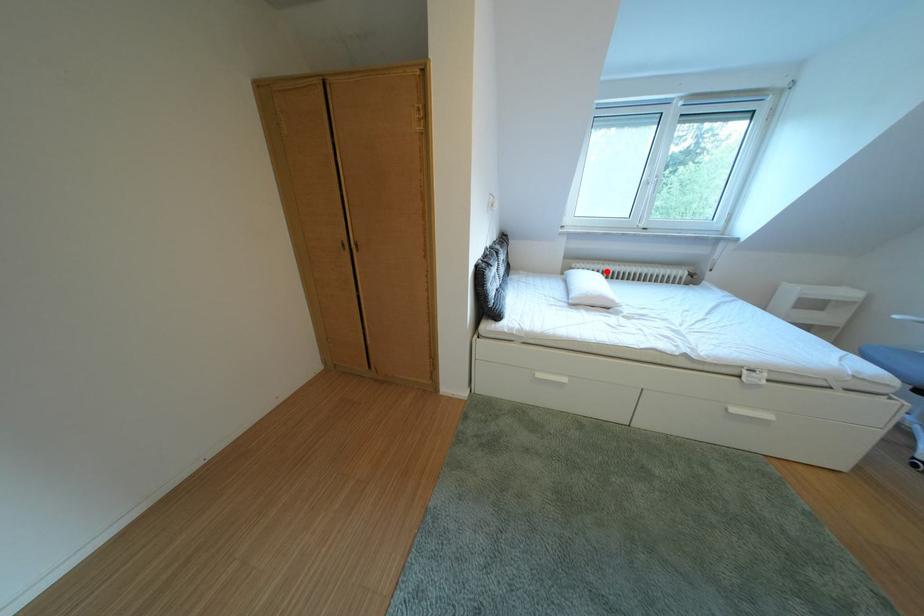
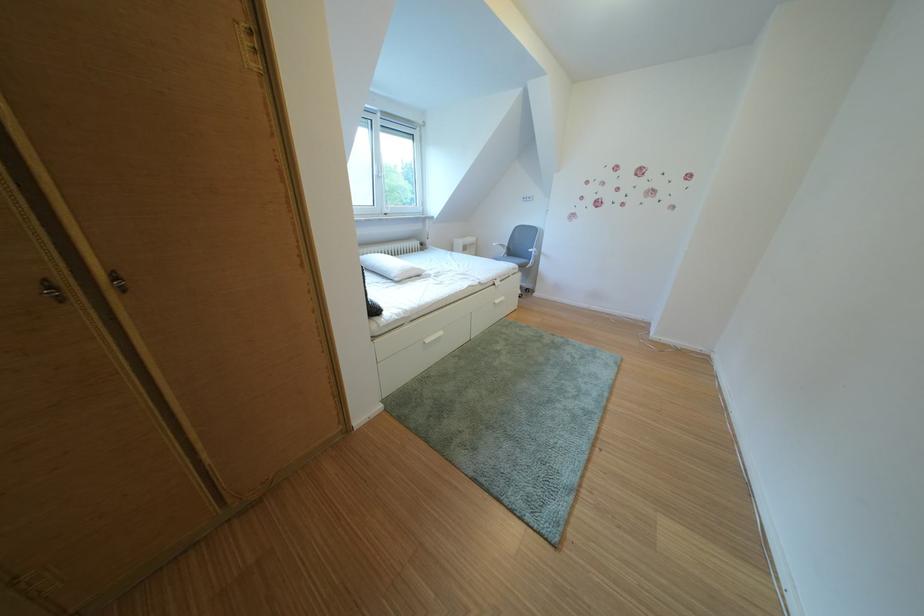
Locate, in the second image, the point that corresponds to the highlighted location in the first image.

(380, 256)